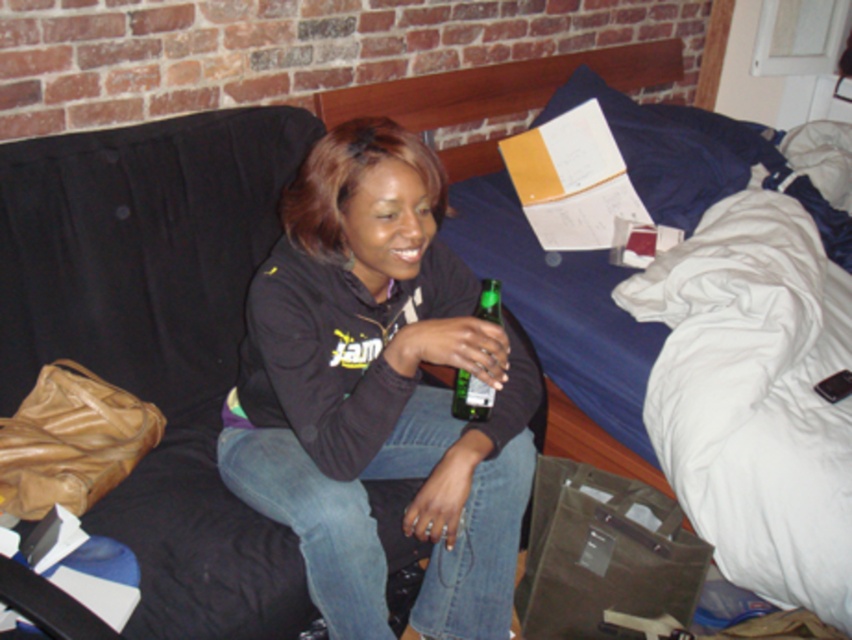
You are standing in the dorm room and want to place a small plant between the two points marked as point (481,152) and point (453,410). Which point should the plant be closer to so it is in front of the other point?

The plant should be closer to point (453,410) because point (481,152) is behind point (453,410), so placing it near the front point keeps it visible.

You are a guest in this room and want to place a small plant on the blue fabric bed at upper center without blocking the green glass bottle at center. Is this possible?

The blue fabric bed at upper center is positioned over the green glass bottle at center, so placing a plant on the bed would block the bottle. Choose another location for the plant.

Please look at the coordinates point at [378,392]. Which object is this point located on?

The point at [378,392] is located on the black matte sweatshirt at center.